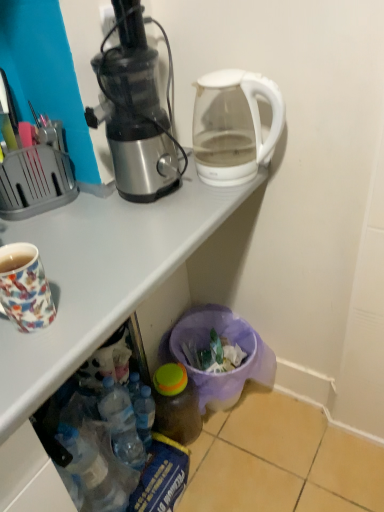
Question: Is translucent plastic bottle at lower center, which ranks as the 2th bottle in left-to-right order, to the right of metallic silver juicer at left from the viewer's perspective?

Choices:
 (A) no
 (B) yes

Answer: (B)

Question: Is metallic silver juicer at left located within translucent plastic bottle at lower center, acting as the first bottle starting from the right?

Choices:
 (A) yes
 (B) no

Answer: (B)

Question: Could you tell me if translucent plastic bottle at lower center, acting as the first bottle starting from the right, is facing metallic silver juicer at left?

Choices:
 (A) yes
 (B) no

Answer: (B)

Question: From the image's perspective, is translucent plastic bottle at lower center, which ranks as the 2th bottle in left-to-right order, above metallic silver juicer at left?

Choices:
 (A) no
 (B) yes

Answer: (A)

Question: Does translucent plastic bottle at lower center, which ranks as the 2th bottle in left-to-right order, have a lesser width compared to metallic silver juicer at left?

Choices:
 (A) yes
 (B) no

Answer: (A)

Question: Is translucent plastic bottle at lower center, acting as the first bottle starting from the right, smaller than metallic silver juicer at left?

Choices:
 (A) yes
 (B) no

Answer: (A)

Question: Is transparent glass kettle at upper right next to translucent plastic bottle at lower center, placed as the 1th bottle when sorted from left to right?

Choices:
 (A) yes
 (B) no

Answer: (B)

Question: Are transparent glass kettle at upper right and translucent plastic bottle at lower center, the second bottle in the right-to-left sequence, located far from each other?

Choices:
 (A) yes
 (B) no

Answer: (B)

Question: From the image's perspective, is transparent glass kettle at upper right over translucent plastic bottle at lower center, the second bottle in the right-to-left sequence?

Choices:
 (A) yes
 (B) no

Answer: (A)

Question: Is translucent plastic bottle at lower center, placed as the 1th bottle when sorted from left to right, a part of transparent glass kettle at upper right?

Choices:
 (A) yes
 (B) no

Answer: (B)

Question: Considering the relative positions of transparent glass kettle at upper right and translucent plastic bottle at lower center, the second bottle in the right-to-left sequence, in the image provided, is transparent glass kettle at upper right behind translucent plastic bottle at lower center, the second bottle in the right-to-left sequence,?

Choices:
 (A) yes
 (B) no

Answer: (B)

Question: Is transparent glass kettle at upper right smaller than translucent plastic bottle at lower center, the second bottle in the right-to-left sequence?

Choices:
 (A) no
 (B) yes

Answer: (A)

Question: From a real-world perspective, is white glossy desk at upper center on top of translucent plastic bottle at lower center, placed as the 1th bottle when sorted from left to right?

Choices:
 (A) no
 (B) yes

Answer: (B)